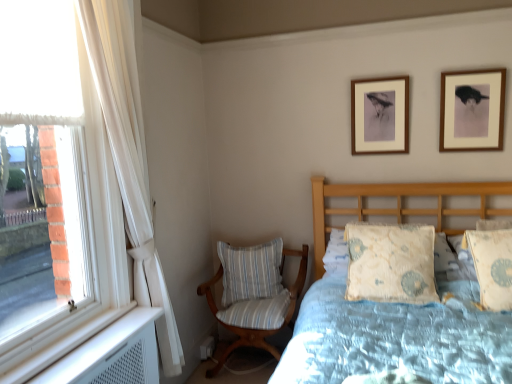
Question: Considering the positions of light blue floral fabric pillow at right, the 1th pillow from the right, and white striped cushion at center, which appears as the third pillow when viewed from the right, in the image, is light blue floral fabric pillow at right, the 1th pillow from the right, bigger or smaller than white striped cushion at center, which appears as the third pillow when viewed from the right,?

Choices:
 (A) small
 (B) big

Answer: (A)

Question: From a real-world perspective, relative to white striped cushion at center, which is the first pillow in left-to-right order, is light blue floral fabric pillow at right, the 3th pillow from the back, vertically above or below?

Choices:
 (A) above
 (B) below

Answer: (A)

Question: Estimate the real-world distances between objects in this image. Which object is farther from the striped fabric chair at lower left?

Choices:
 (A) wooden picture frame at upper center, marked as the second picture frame in a right-to-left arrangement
 (B) white striped cushion at center, the third pillow viewed from the front
 (C) white sheer curtain at left
 (D) light blue floral fabric pillow at right, the 3th pillow from the back
 (E) wooden picture frame at upper right, which ranks as the first picture frame in front-to-back order

Answer: (E)

Question: Which object is the farthest from the striped fabric chair at lower left?

Choices:
 (A) wooden picture frame at upper center, the 2th picture frame from the front
 (B) light blue floral pillow at center, the 2th pillow when ordered from right to left
 (C) light blue floral fabric pillow at right, the 1th pillow from the right
 (D) wooden picture frame at upper right, which is counted as the 2th picture frame, starting from the back
 (E) white striped cushion at center, which appears as the third pillow when viewed from the right

Answer: (D)